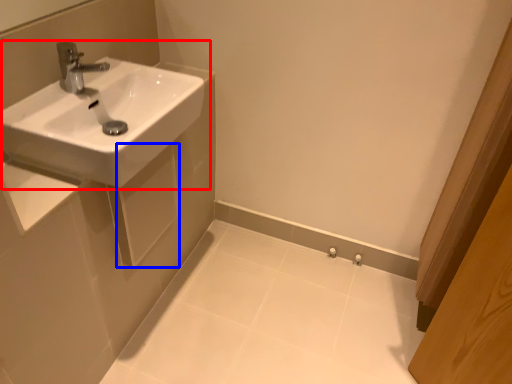
Question: Among these objects, which one is farthest to the camera, sink (highlighted by a red box) or square (highlighted by a blue box)?

Choices:
 (A) sink
 (B) square

Answer: (B)